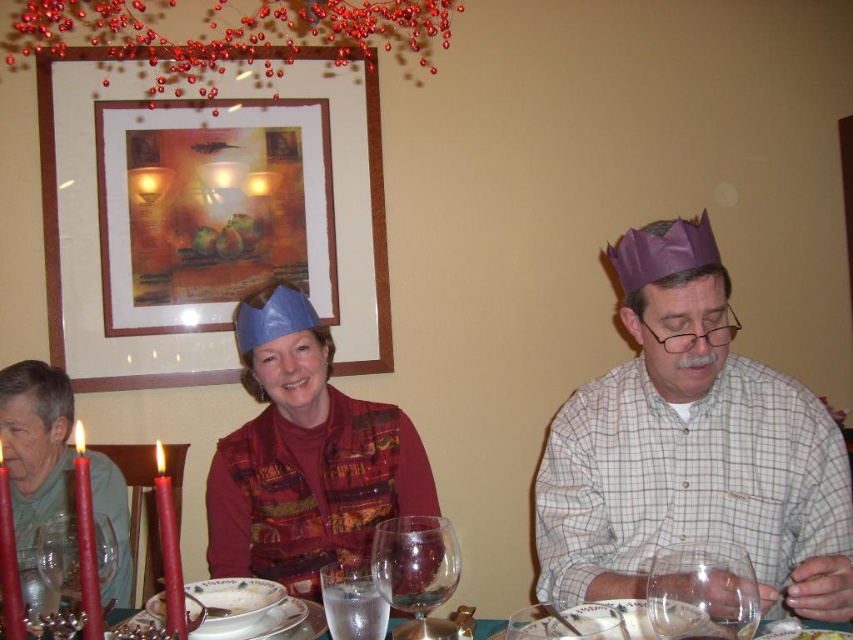
Question: Does purple paper crown at right appear over matte blue paper crown at center?

Choices:
 (A) yes
 (B) no

Answer: (A)

Question: Which point is closer to the camera?

Choices:
 (A) transparent glass wine glass at center
 (B) purple paper crown at right

Answer: (A)

Question: Considering the relative positions of purple paper crown at right and clear glass wine glass at center in the image provided, where is purple paper crown at right located with respect to clear glass wine glass at center?

Choices:
 (A) left
 (B) right

Answer: (B)

Question: Among these objects, which one is nearest to the camera?

Choices:
 (A) white porcelain bowl at lower left
 (B) clear glass wine glass at left
 (C) transparent glass wine glass at lower right
 (D) clear glass water at center

Answer: (B)

Question: Which point is farther from the camera taking this photo?

Choices:
 (A) click(x=192, y=228)
 (B) click(x=213, y=634)
 (C) click(x=108, y=547)

Answer: (A)

Question: Is matte blue paper crown at center behind transparent glass wine glass at lower right?

Choices:
 (A) no
 (B) yes

Answer: (B)